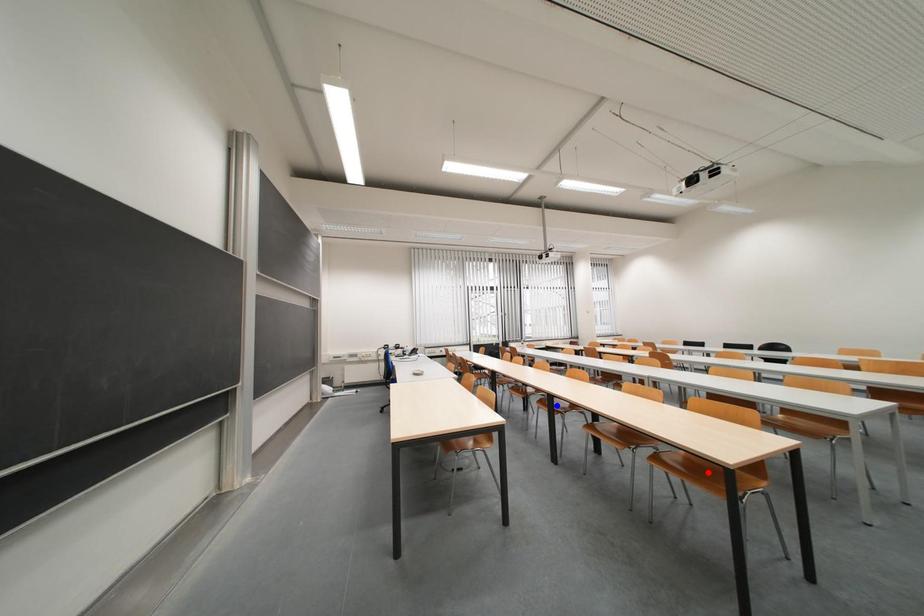
Question: In the image, two points are highlighted. Which point is nearer to the camera? Reply with the corresponding letter.

Choices:
 (A) blue point
 (B) red point

Answer: (B)